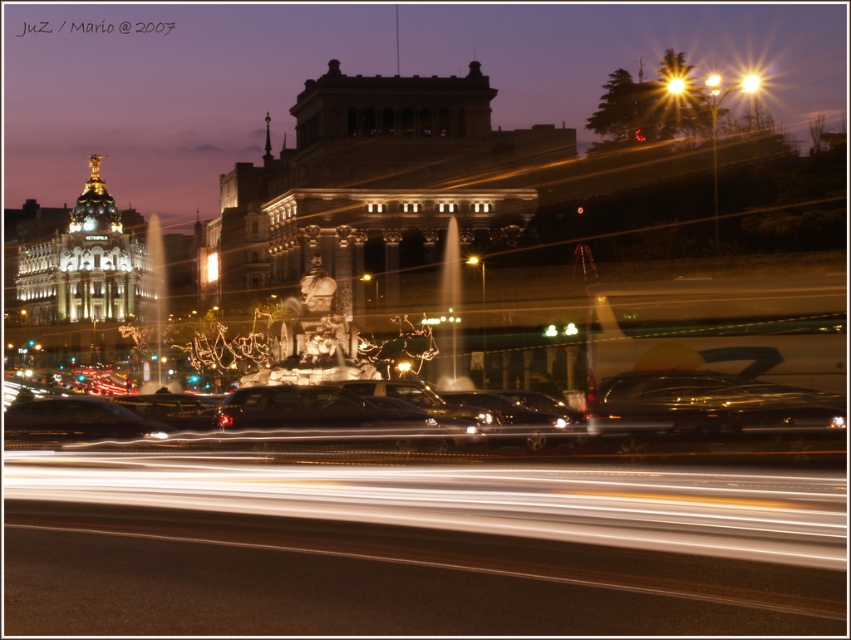
You are a photographer wanting to capture the black glossy car at center under the bright yellow light at upper center. Can you confirm if the car is illuminated by the light?

The black glossy car at center is positioned under the bright yellow light at upper center, so yes, the car is illuminated by the light.